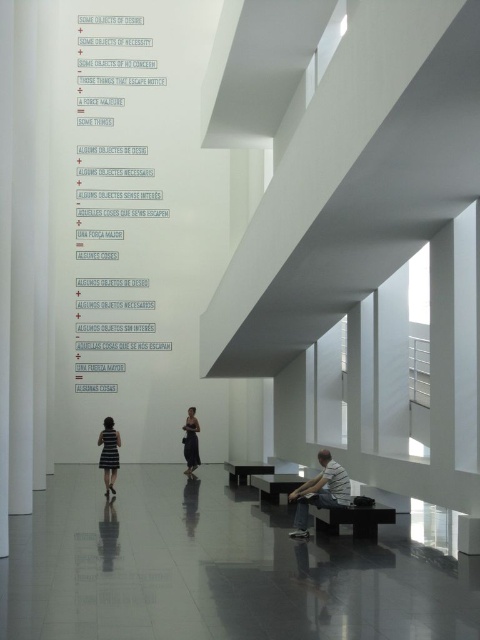
You are standing in the art gallery and want to take a photo of the point at coordinates (348, 500). The camera you are using has a maximum focus range of 15 meters. Will the point be in focus?

The point at coordinates (348, 500) is 16.12 meters away from the camera, which exceeds the maximum focus range of 15 meters. Therefore, the point will not be in focus.

You are an art curator standing in the gallery. You notice two points marked on the wall. The first point is at coordinate (189, 438) and the second is at (249, 472). From your current position, which point is closer to you?

Point (249, 472) is closer to you because it is in front of point (189, 438) according to their spatial arrangement.

You are an interior designer working on a minimalist art gallery layout. You need to place a new sculpture exactly at the point marked by the coordinates point [320,492]. However, there is already an object at that location. What object is currently occupying that space?

The point [320,492] corresponds to the light gray tshirt at lower center, so the light gray tshirt at lower center is currently occupying that space.